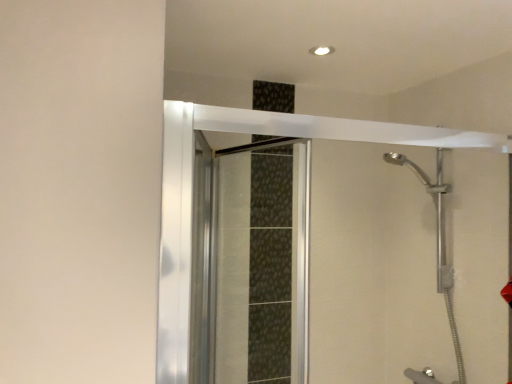
The height and width of the screenshot is (384, 512). Describe the element at coordinates (263, 264) in the screenshot. I see `clear glass shower door at center` at that location.

Where is `clear glass shower door at center`? clear glass shower door at center is located at coordinates (263, 264).

At what (x,y) coordinates should I click in order to perform the action: click on clear glass shower door at center. Please return your answer as a coordinate pair (x, y). The height and width of the screenshot is (384, 512). Looking at the image, I should click on coord(263,264).